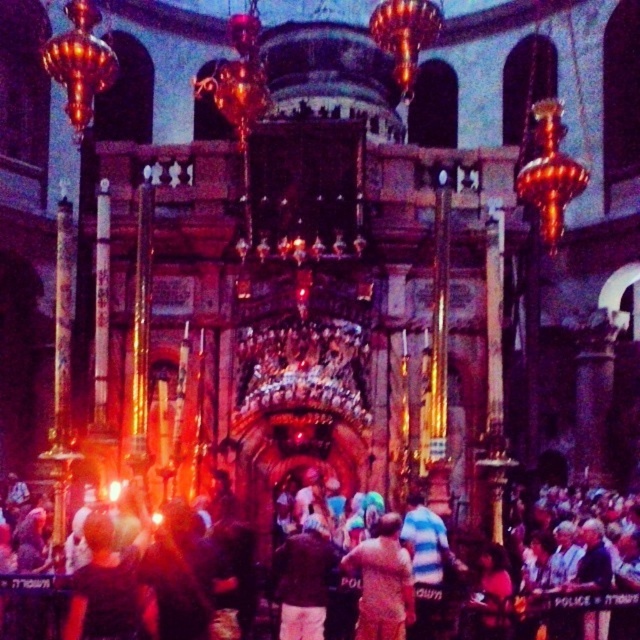
You are an interior designer planning to hang a decorative banner between the brown fabric shirt at center and the light brown leather jacket at center. Which object should you place the banner closer to if you want it to be centered between them?

The banner should be placed closer to the light brown leather jacket at center because the brown fabric shirt at center is wider, so the center point between them would be shifted towards the narrower object.